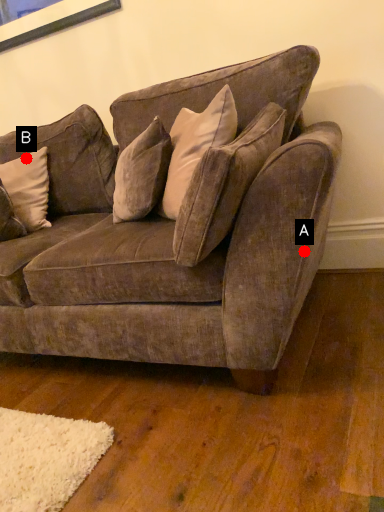
Question: Two points are circled on the image, labeled by A and B beside each circle. Which point is farther to the camera?

Choices:
 (A) A is further
 (B) B is further

Answer: (B)